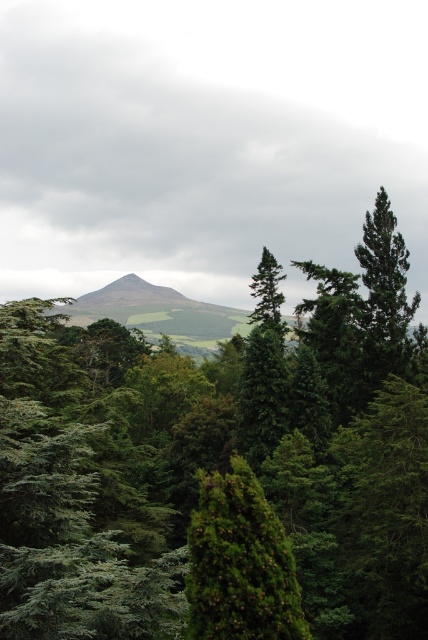
Question: Does green textured tree at center appear on the right side of green matte tree at center?

Choices:
 (A) yes
 (B) no

Answer: (B)

Question: Can you confirm if green leafy trees at center is wider than green textured tree at center?

Choices:
 (A) no
 (B) yes

Answer: (B)

Question: Among these points, which one is farthest from the camera?

Choices:
 (A) (368, 248)
 (B) (14, 353)
 (C) (104, 289)
 (D) (290, 620)

Answer: (C)

Question: Which point is farther to the camera?

Choices:
 (A) (285, 595)
 (B) (401, 317)
 (C) (247, 420)
 (D) (241, 323)

Answer: (D)

Question: Is green leafy trees at center positioned behind green matte tree at center?

Choices:
 (A) no
 (B) yes

Answer: (A)

Question: Which of the following is the farthest from the observer?

Choices:
 (A) green grassy hill at center
 (B) green leafy trees at center
 (C) green textured tree at center
 (D) green matte tree at upper right

Answer: (D)